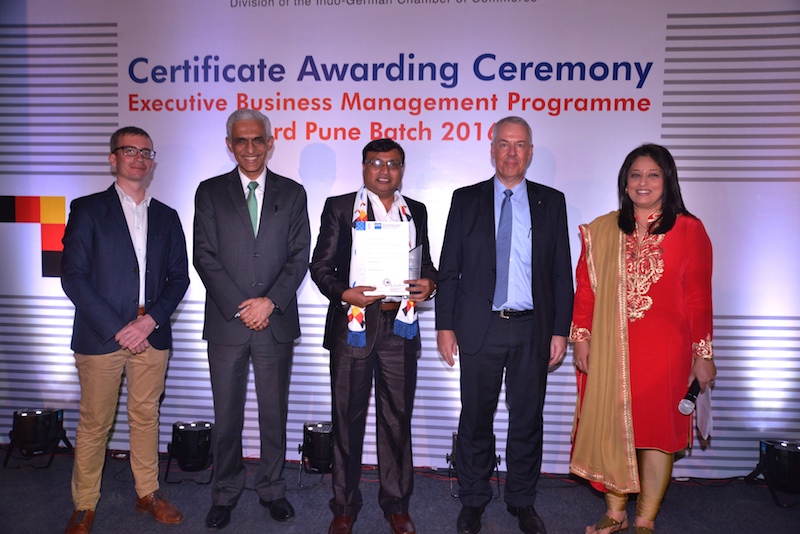
Find the location of a particular element. The width and height of the screenshot is (800, 534). certificate is located at coordinates (384, 246).